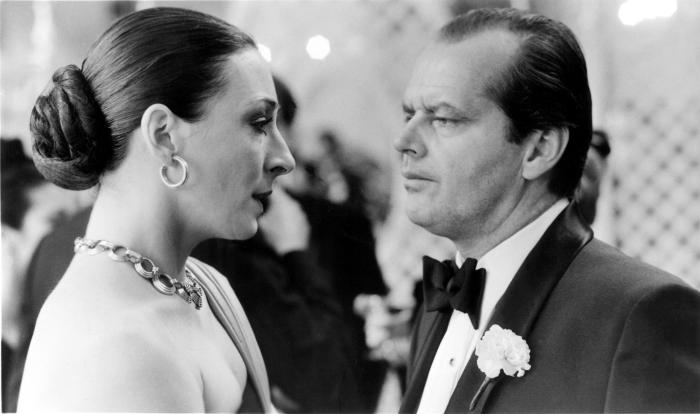
At what (x,y) coordinates should I click in order to perform the action: click on lights. Please return your answer as a coordinate pair (x, y). Image resolution: width=700 pixels, height=414 pixels. Looking at the image, I should click on (645, 1), (318, 48).